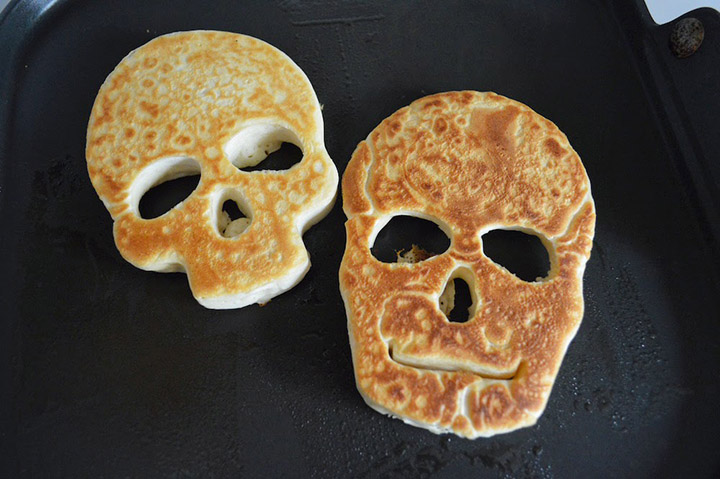
At what (x,y) coordinates should I click in order to perform the action: click on the bottom right corner empty space. Please return your answer as a coordinate pair (x, y). This screenshot has height=479, width=720. Looking at the image, I should click on (716, 475).